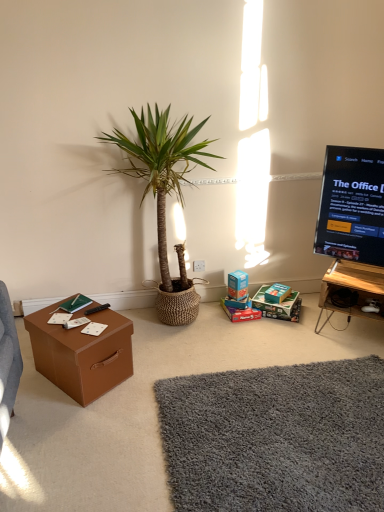
This screenshot has height=512, width=384. In order to click on free space between shaggy gray rug at lower center, placed as the 2th plain when sorted from front to back, and matte cardboard box at lower center, which ranks as the 3th storage box in right-to-left order in this screenshot , I will do `click(245, 343)`.